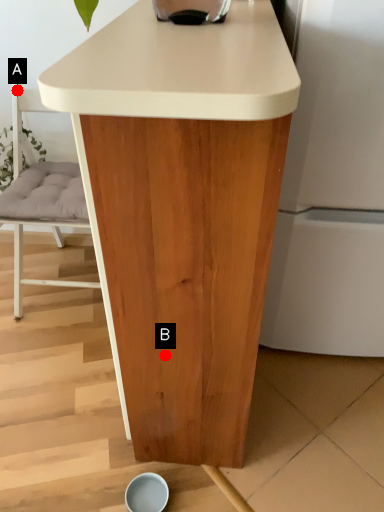
Question: Two points are circled on the image, labeled by A and B beside each circle. Which of the following is the farthest from the observer?

Choices:
 (A) A is further
 (B) B is further

Answer: (A)